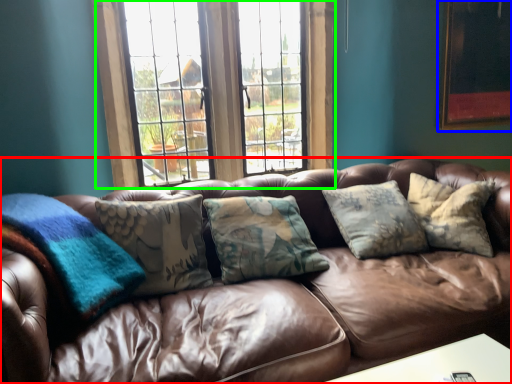
Question: Which object is the closest to the studio couch (highlighted by a red box)? Choose among these: picture frame (highlighted by a blue box) or window (highlighted by a green box).

Choices:
 (A) picture frame
 (B) window

Answer: (B)